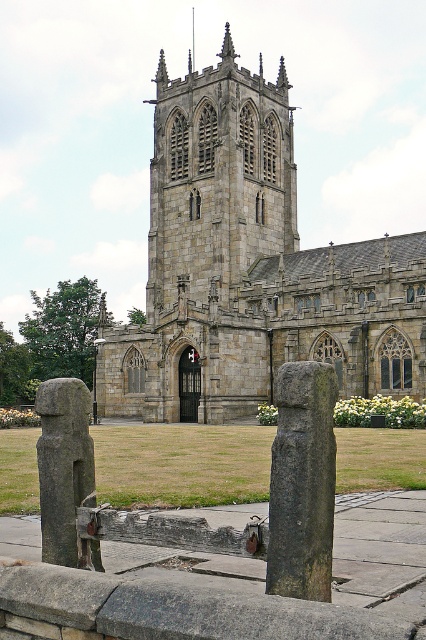
Question: Does dark gray stone pillar at center have a lesser width compared to gray stone post at center?

Choices:
 (A) yes
 (B) no

Answer: (B)

Question: Which of the following is the closest to the observer?

Choices:
 (A) dark gray stone pillar at center
 (B) gray stone post at center
 (C) stone gothic church at center

Answer: (A)

Question: Does dark gray stone pillar at center lie in front of gray stone post at center?

Choices:
 (A) no
 (B) yes

Answer: (B)

Question: Can you confirm if dark gray stone pillar at center is positioned above gray stone post at center?

Choices:
 (A) no
 (B) yes

Answer: (B)

Question: Which object is farther from the camera taking this photo?

Choices:
 (A) dark gray stone pillar at center
 (B) gray stone post at center
 (C) stone gothic church at center

Answer: (C)

Question: Which point is closer to the camera taking this photo?

Choices:
 (A) (216, 355)
 (B) (72, 557)

Answer: (B)